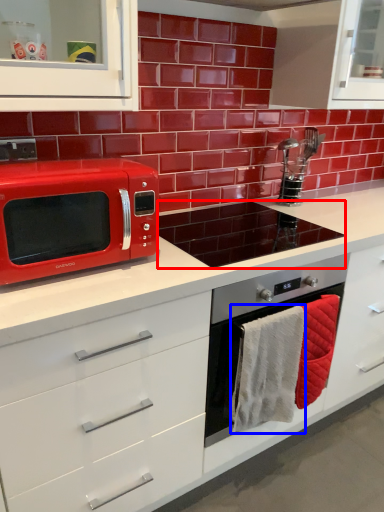
Question: Among these objects, which one is nearest to the camera, appliance (highlighted by a red box) or hand towel (highlighted by a blue box)?

Choices:
 (A) appliance
 (B) hand towel

Answer: (B)